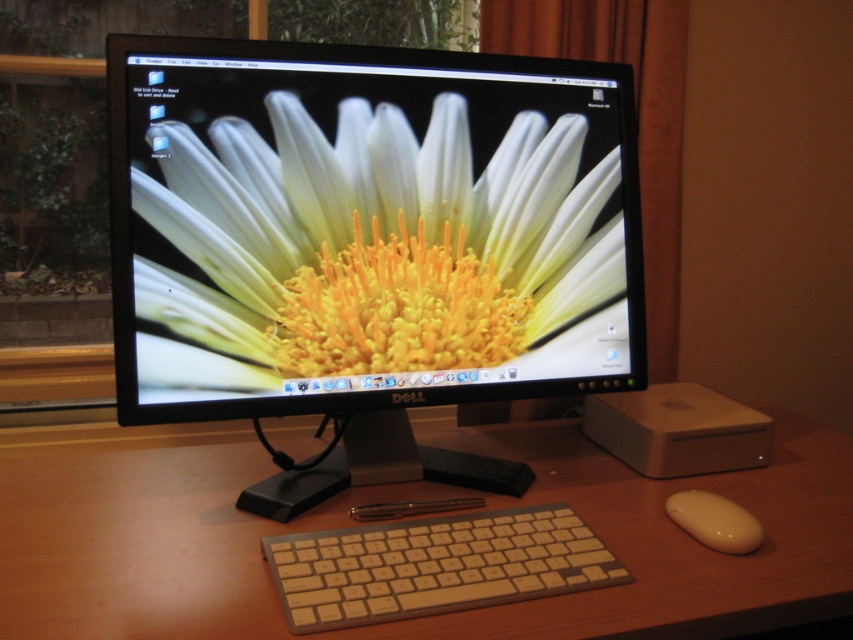
Does matte plastic monitor at center have a greater width compared to white glossy mouse at lower right?

Yes.

Based on the photo, can you confirm if matte plastic monitor at center is taller than white glossy mouse at lower right?

Indeed, matte plastic monitor at center has a greater height compared to white glossy mouse at lower right.

Locate an element on the screen. matte plastic monitor at center is located at coordinates (367, 228).

What are the coordinates of `matte plastic monitor at center` in the screenshot? It's located at (367, 228).

From the picture: Is wooden at center above beige plastic keyboard at center?

Yes, wooden at center is above beige plastic keyboard at center.

Does point (265, 580) come closer to viewer compared to point (306, 573)?

No.

Who is more distant from viewer, (27, 547) or (477, 573)?

The point (27, 547) is more distant.

Find the location of `wooden at center`. wooden at center is located at coordinates (392, 500).

Can you confirm if matte plastic monitor at center is positioned above wooden at center?

Yes, matte plastic monitor at center is above wooden at center.

I want to click on matte plastic monitor at center, so coord(367,228).